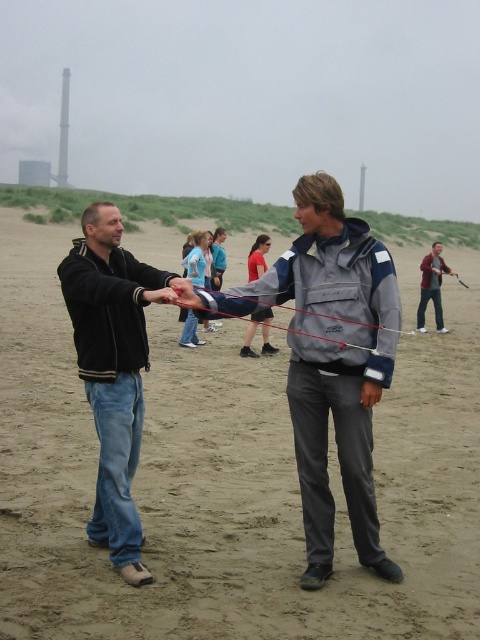
Looking at this image, you are standing at the origin point of the coordinate system where the beach scene is displayed. You need to locate the gray fabric jacket at center. What are its coordinates?

The gray fabric jacket at center is located at coordinates point (331, 362).

Consider the image. You are a photographer standing at the center of the beach scene. You want to take a photo that includes both the point at coordinates point [316,490] and point [382,317]. Which point should you focus on first to ensure both are in sharp focus?

You should focus on point [382,317] first because it is closer to you than point [316,490], which is further away. This way, the depth of field will cover both points effectively.

You are standing at the center of the beach and want to locate the black matte jacket at left. Which direction should you look to find it?

The black matte jacket at left is located at point 0.580 on the x axis and 0.235 on the y axis. Since you are at the center, you should look to the right direction to find it.